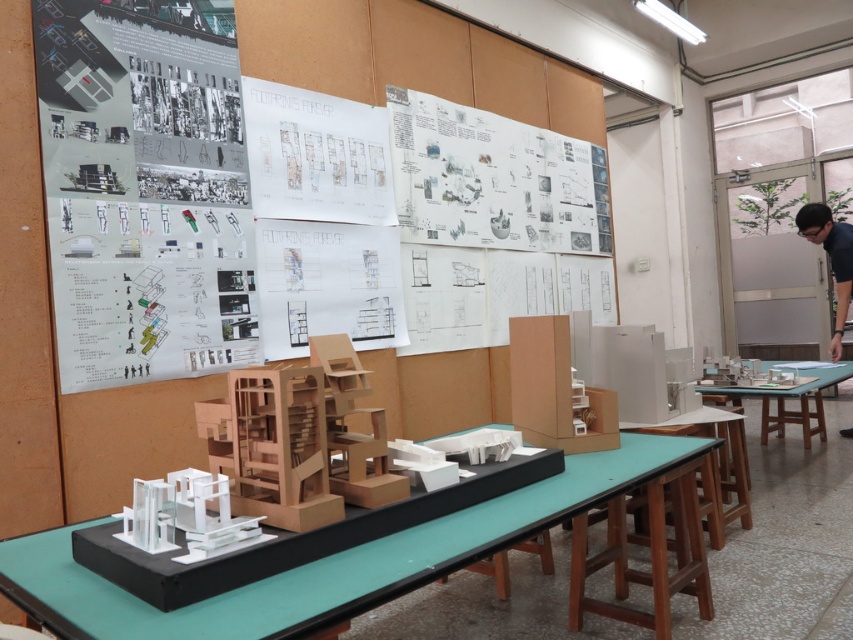
You are an architect standing in the studio and want to retrieve the white paper at upper center and the white glossy model at center. Which object will you need to reach for first?

You will need to reach for the white paper at upper center first because it is closer to you than the white glossy model at center, which is further away.

You are an architect standing in the studio. You need to move a blueprint from the wall to the green matte table at center. The blueprint is currently on the wall near the black shirt at right. Can you reach the table from that position without moving your feet?

The black shirt at right and green matte table at center are 3.32 feet apart. Since the distance is over 3 feet, you cannot reach the green matte table at center from the black shirt at right without moving your feet.